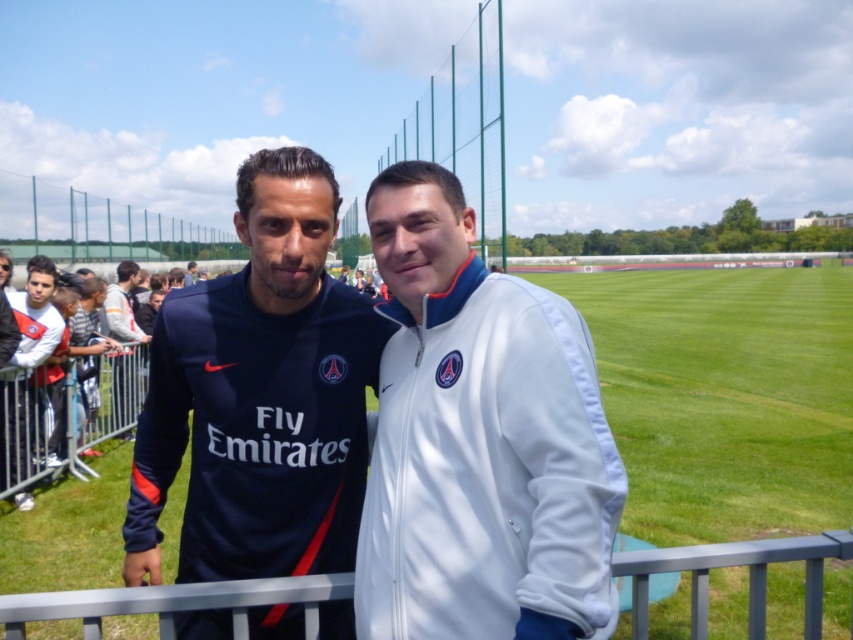
You are standing at the point marked as point (514,368) in the image. You want to walk towards the goalpost visible in the distance. Is the fence between you and the goalpost?

The distance of point (514,368) from viewer is 1.49 meters. Since the fence is between the field and the area where the two individuals are standing, and you are at point (514,368) which is likely in the area where the individuals are, the fence is between you and the goalpost.

You are a photographer trying to capture a closeup of the dark blue jersey at center. Based on its 2D coordinates, where should you position your camera relative to the image frame?

The dark blue jersey at center is located at coordinates 0.617 on the x axis and 0.306 on the y axis, so the camera should be positioned to focus on that point within the image frame.